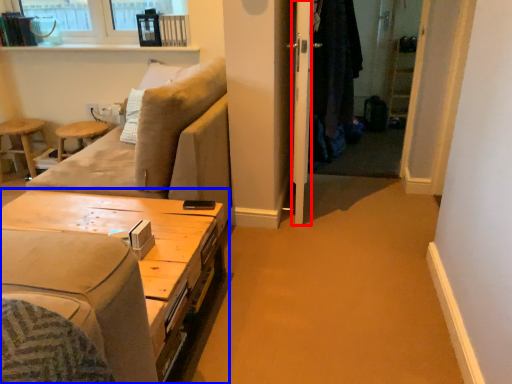
Question: Which object appears farthest to the camera in this image, screen door (highlighted by a red box) or table (highlighted by a blue box)?

Choices:
 (A) screen door
 (B) table

Answer: (A)